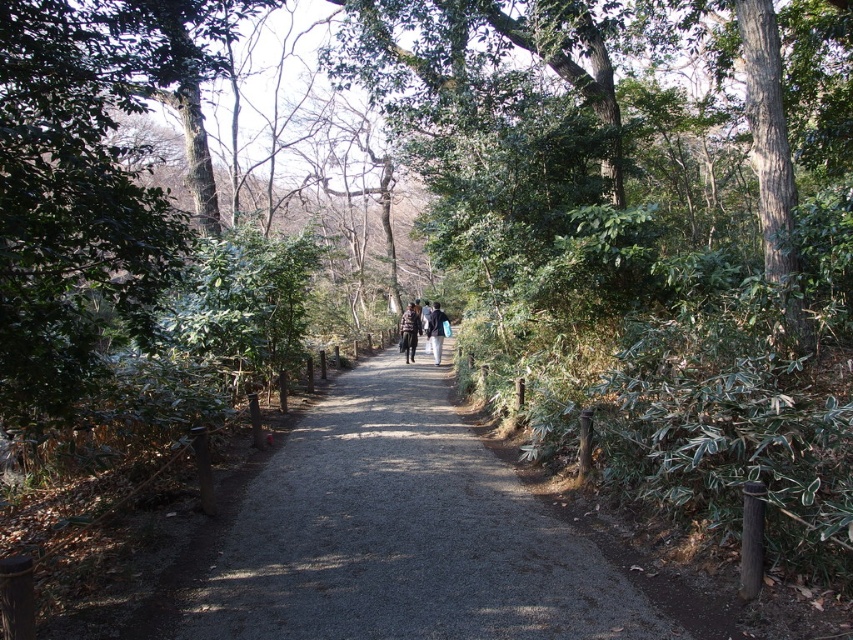
Which is more to the left, plaid fabric jacket at center or dark blue jacket at center?

From the viewer's perspective, plaid fabric jacket at center appears more on the left side.

Which of these two, plaid fabric jacket at center or dark blue jacket at center, stands taller?

With more height is dark blue jacket at center.

Is point (404, 349) less distant than point (438, 317)?

That is False.

This screenshot has height=640, width=853. Find the location of `plaid fabric jacket at center`. plaid fabric jacket at center is located at coordinates (409, 332).

Which is above, gray gravel path at center or dark blue jacket at center?

dark blue jacket at center

Does gray gravel path at center have a greater height compared to dark blue jacket at center?

Incorrect, gray gravel path at center's height is not larger of dark blue jacket at center's.

Find the location of a particular element. gray gravel path at center is located at coordinates [x=392, y=538].

Between gray gravel path at center and plaid fabric jacket at center, which one is positioned higher?

plaid fabric jacket at center is higher up.

Is point (389, 589) closer to viewer compared to point (413, 305)?

Yes, point (389, 589) is in front of point (413, 305).

Image resolution: width=853 pixels, height=640 pixels. I want to click on gray gravel path at center, so click(x=392, y=538).